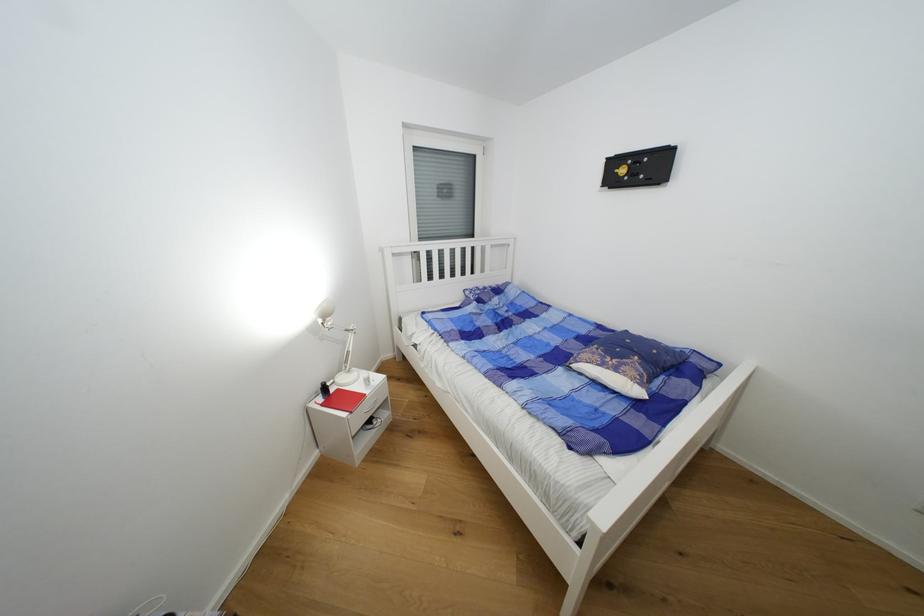
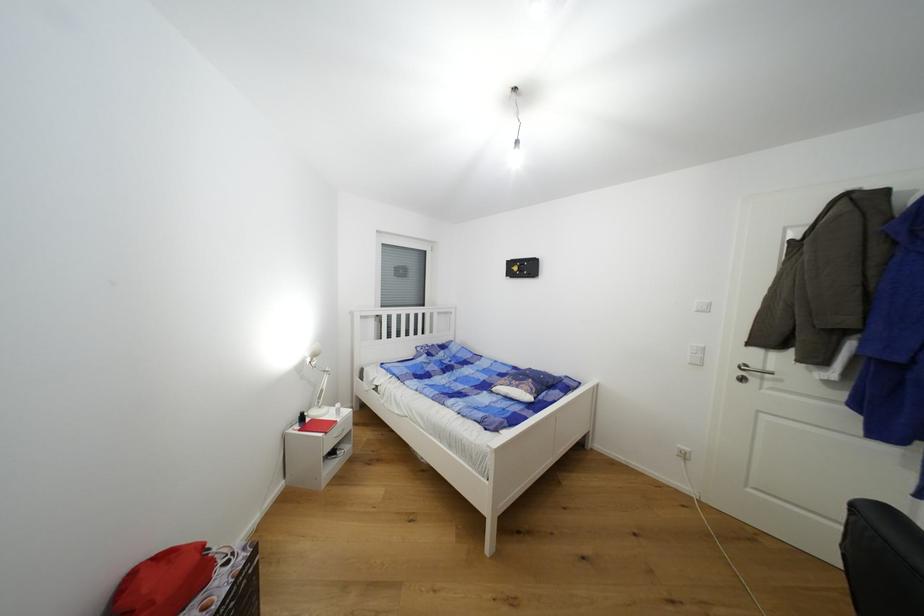
Question: The first image is from the beginning of the video and the second image is from the end. How did the camera likely rotate when shooting the video?

Choices:
 (A) Left
 (B) Right
 (C) Up
 (D) Down

Answer: (C)